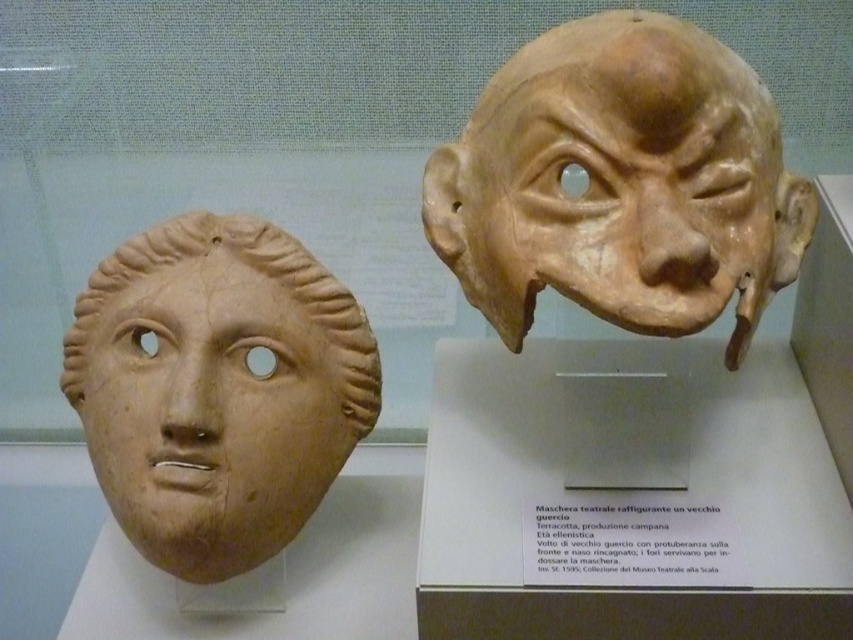
Question: Which point is farther to the camera?

Choices:
 (A) (692, 244)
 (B) (206, 401)

Answer: (B)

Question: Which object appears closest to the camera in this image?

Choices:
 (A) matte terracotta mask at left
 (B) matte clay mask at upper right

Answer: (B)

Question: Does matte clay mask at upper right lie in front of matte terracotta mask at left?

Choices:
 (A) yes
 (B) no

Answer: (A)

Question: Can you confirm if matte clay mask at upper right is thinner than matte terracotta mask at left?

Choices:
 (A) no
 (B) yes

Answer: (A)

Question: Observing the image, what is the correct spatial positioning of matte clay mask at upper right in reference to matte terracotta mask at left?

Choices:
 (A) below
 (B) above

Answer: (B)